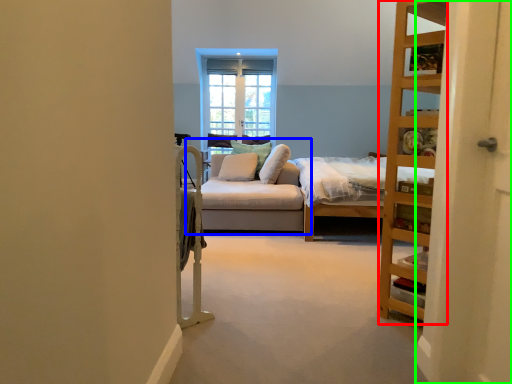
Question: Which object is the farthest from shelf (highlighted by a red box)? Choose among these: studio couch (highlighted by a blue box) or screen door (highlighted by a green box).

Choices:
 (A) studio couch
 (B) screen door

Answer: (A)